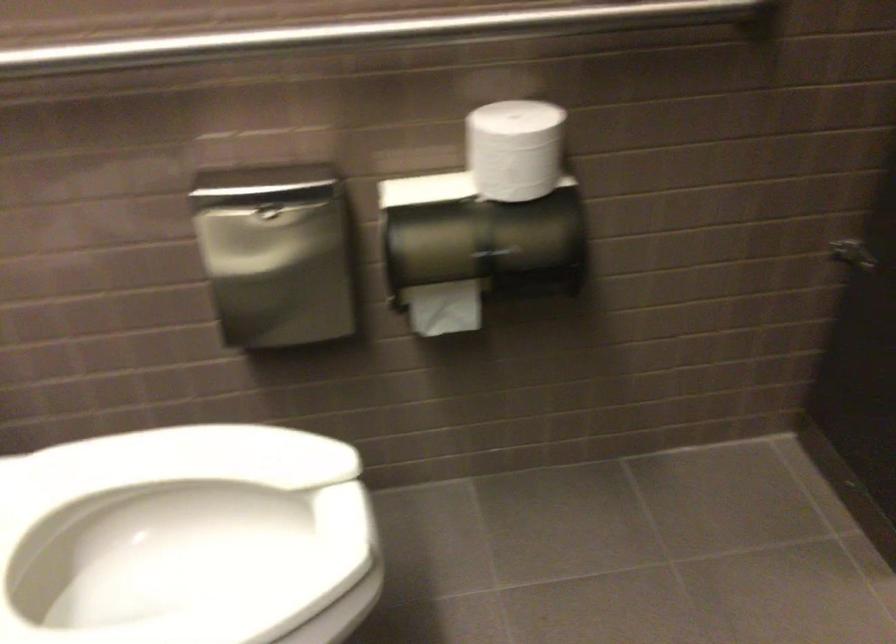
Describe the element at coordinates (368, 33) in the screenshot. I see `the metal grab bar` at that location.